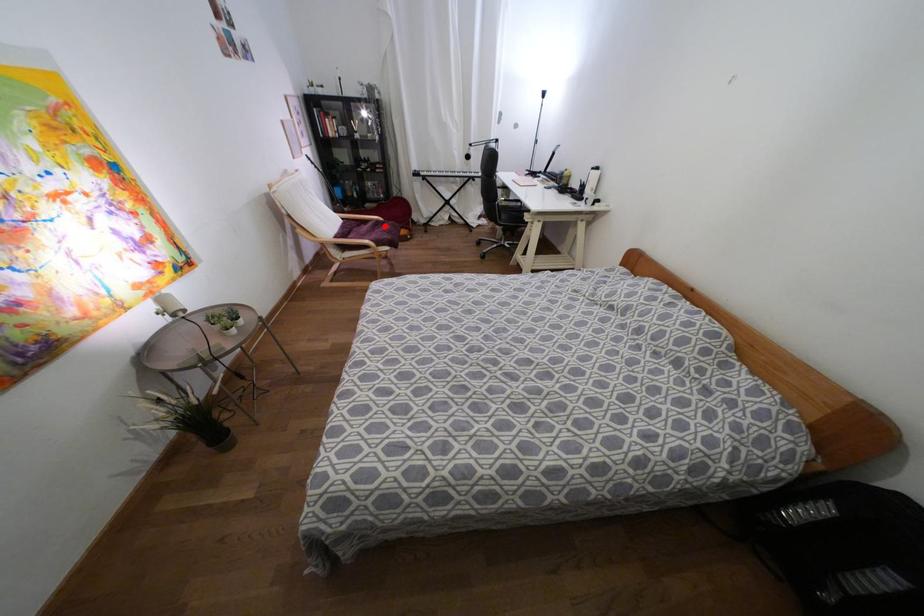
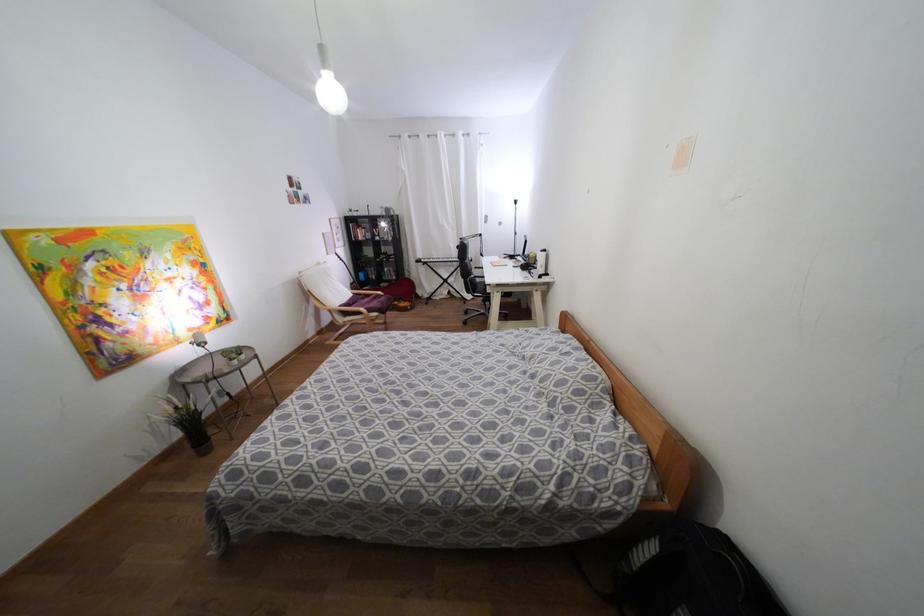
Question: I am providing you with two images of the same scene from different viewpoints. Image1 has a red point marked. In image2, the corresponding 3D location appears at what relative position? Reply with the corresponding letter.

Choices:
 (A) Closer
 (B) Farther

Answer: (A)